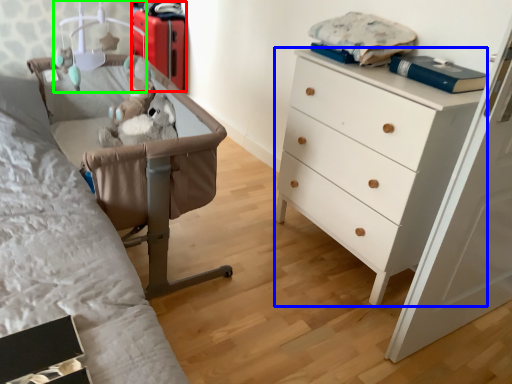
Question: Estimate the real-world distances between objects in this image. Which object is farther from luggage (highlighted by a red box), chest of drawers (highlighted by a blue box) or lamp (highlighted by a green box)?

Choices:
 (A) chest of drawers
 (B) lamp

Answer: (A)